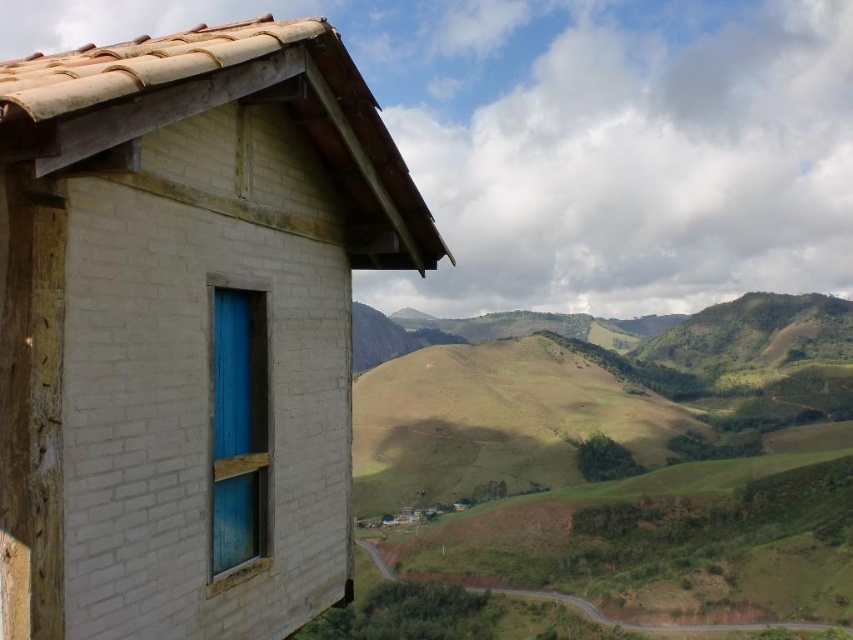
You are a painter planning to paint the white brick hut at upper left and the blue painted wood window at center. If you want to use the same amount of paint for both, which object should you paint first to ensure you have enough paint?

The white brick hut at upper left is bigger than the blue painted wood window at center, so you should paint the blue painted wood window at center first to ensure there is enough paint left for the larger white brick hut at upper left.

You are a photographer planning to take a picture of the white brick hut at upper left and the blue painted wood window at center. Which object should you focus on first if you want to capture both in a single shot without moving the camera?

The white brick hut at upper left is above the blue painted wood window at center, so you should focus on the white brick hut at upper left first to ensure both are in frame.